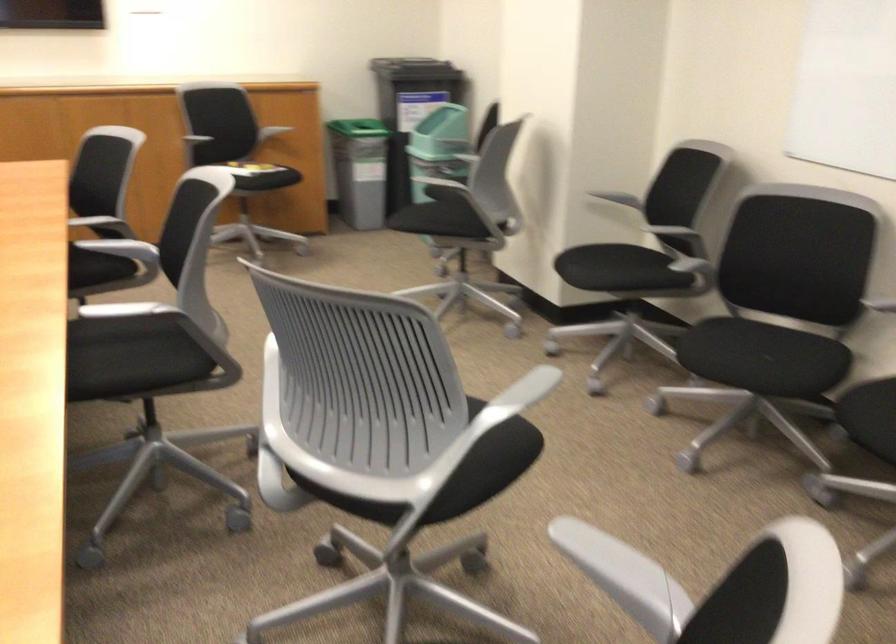
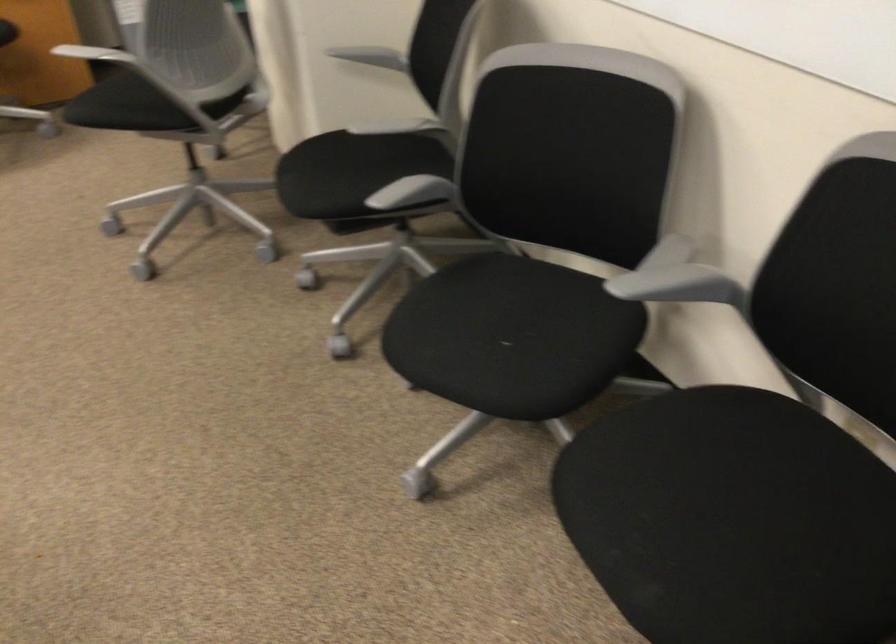
What movement of the cameraman would produce the second image?

The movement direction of the cameraman is right, forward.